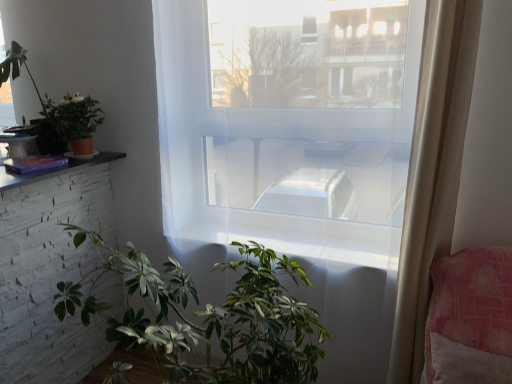
Question: Does matte white table at left have a larger size compared to green matte plant at lower center, acting as the third houseplant starting from the top?

Choices:
 (A) yes
 (B) no

Answer: (B)

Question: Could you tell me if matte white table at left is turned towards green matte plant at lower center, acting as the third houseplant starting from the top?

Choices:
 (A) no
 (B) yes

Answer: (A)

Question: Considering the relative positions of matte white table at left and green matte plant at lower center, acting as the third houseplant starting from the top, in the image provided, is matte white table at left to the left of green matte plant at lower center, acting as the third houseplant starting from the top, from the viewer's perspective?

Choices:
 (A) no
 (B) yes

Answer: (B)

Question: From a real-world perspective, is matte white table at left positioned over green matte plant at lower center, acting as the first houseplant starting from the bottom, based on gravity?

Choices:
 (A) no
 (B) yes

Answer: (B)

Question: Does matte white table at left have a lesser width compared to green matte plant at lower center, which is counted as the 3th houseplant, starting from the left?

Choices:
 (A) no
 (B) yes

Answer: (B)

Question: Looking at their shapes, would you say transparent glass window at center is wider or thinner than green matte plant at upper left, placed as the second houseplant when sorted from bottom to top?

Choices:
 (A) thin
 (B) wide

Answer: (A)

Question: From the image's perspective, is transparent glass window at center positioned above or below green matte plant at upper left, positioned as the second houseplant in top-to-bottom order?

Choices:
 (A) below
 (B) above

Answer: (A)

Question: Based on their sizes in the image, would you say transparent glass window at center is bigger or smaller than green matte plant at upper left, which is the second houseplant from left to right?

Choices:
 (A) small
 (B) big

Answer: (B)

Question: Considering the positions of point (169, 145) and point (95, 112), is point (169, 145) closer or farther from the camera than point (95, 112)?

Choices:
 (A) farther
 (B) closer

Answer: (B)

Question: In the image, is green matte plant at lower center, acting as the first houseplant starting from the bottom, on the left side or the right side of green matte plant at upper left, the 3th houseplant in the right-to-left sequence?

Choices:
 (A) left
 (B) right

Answer: (B)

Question: Considering the positions of green matte plant at lower center, acting as the third houseplant starting from the top, and green matte plant at upper left, which ranks as the 3th houseplant in bottom-to-top order, in the image, is green matte plant at lower center, acting as the third houseplant starting from the top, wider or thinner than green matte plant at upper left, which ranks as the 3th houseplant in bottom-to-top order,?

Choices:
 (A) wide
 (B) thin

Answer: (A)

Question: In the image, is green matte plant at lower center, acting as the third houseplant starting from the top, positioned in front of or behind green matte plant at upper left, which is the 1th houseplant in top-to-bottom order?

Choices:
 (A) front
 (B) behind

Answer: (A)

Question: Considering the positions of point (249, 380) and point (65, 132), is point (249, 380) closer or farther from the camera than point (65, 132)?

Choices:
 (A) farther
 (B) closer

Answer: (B)

Question: Looking at their shapes, would you say green matte plant at upper left, placed as the second houseplant when sorted from bottom to top, is wider or thinner than green matte plant at lower center, which ranks as the first houseplant in right-to-left order?

Choices:
 (A) thin
 (B) wide

Answer: (A)

Question: Looking at the image, does green matte plant at upper left, which is the second houseplant from left to right, seem bigger or smaller compared to green matte plant at lower center, which ranks as the first houseplant in right-to-left order?

Choices:
 (A) small
 (B) big

Answer: (A)